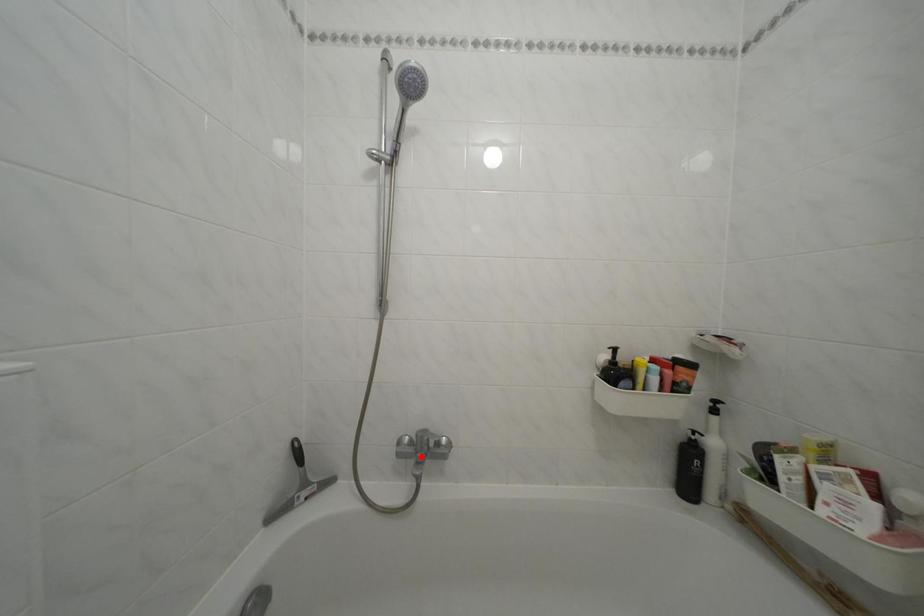
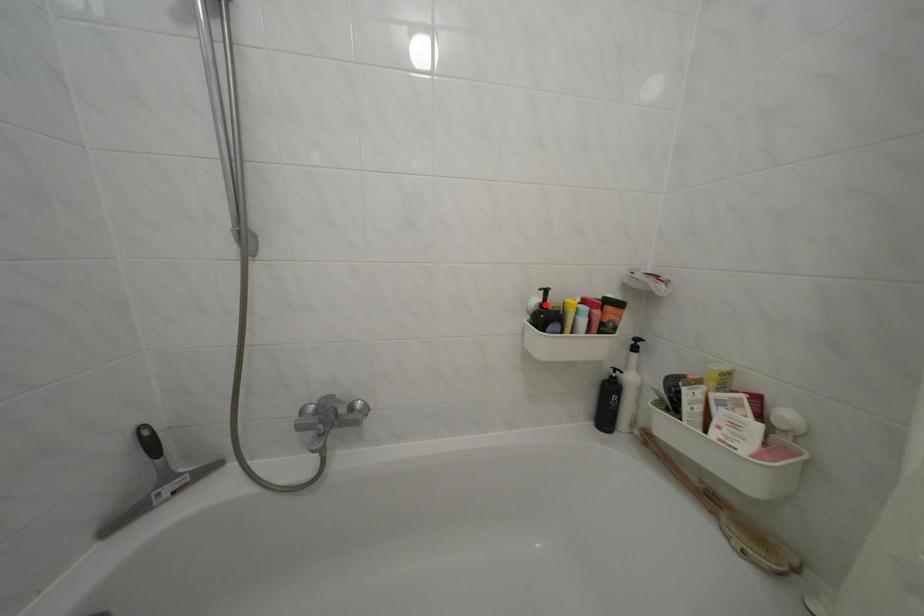
I am providing you with two images of the same scene from different viewpoints. A red point is marked on the first image and another point is marked on the second image. Are the points marked in image1 and image2 representing the same 3D position?

No